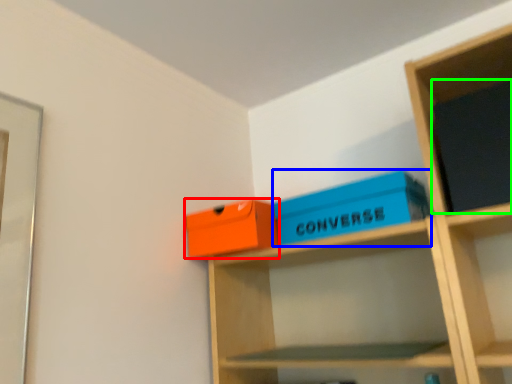
Question: Based on their relative distances, which object is nearer to box (highlighted by a red box)? Choose from box (highlighted by a blue box) and paperback book (highlighted by a green box).

Choices:
 (A) box
 (B) paperback book

Answer: (A)